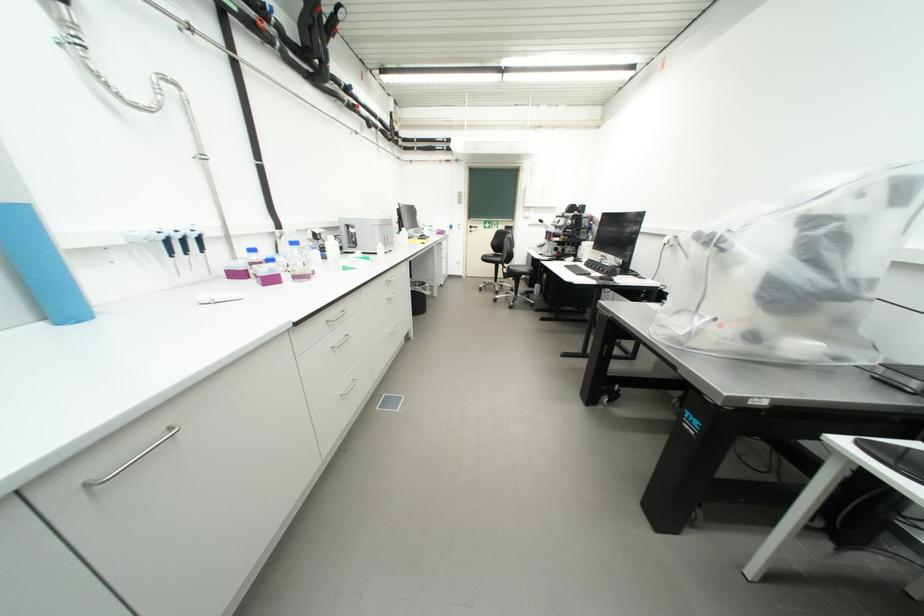
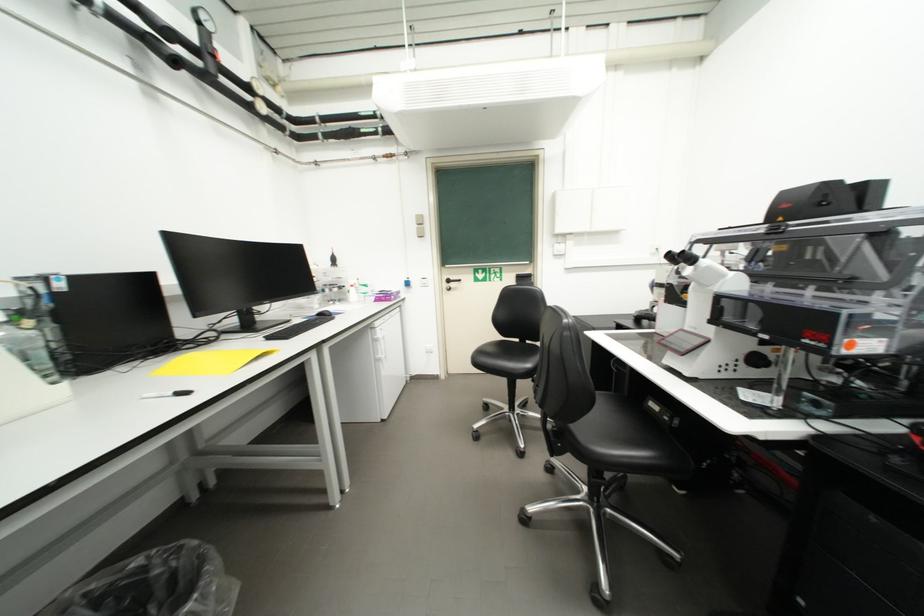
In the second image, find the point that corresponds to (479,229) in the first image.

(456, 283)